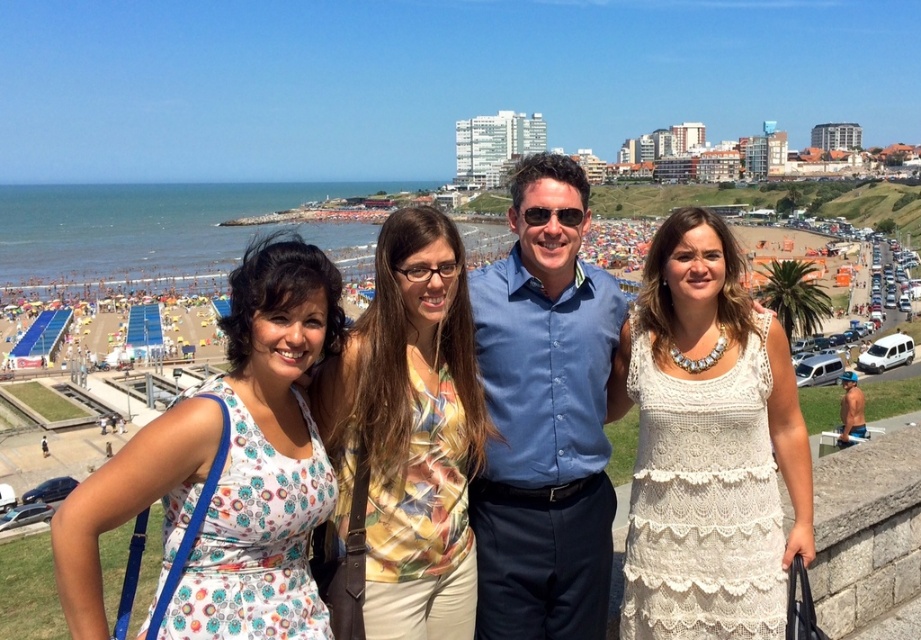
You are taking a photo of the group and want to focus on two specific points in the image. The first point is at coordinate point(98, 598) and the second is at point(346, 449). Which point is closer to you?

Point(98, 598) is closer to the viewer than point(346, 449).